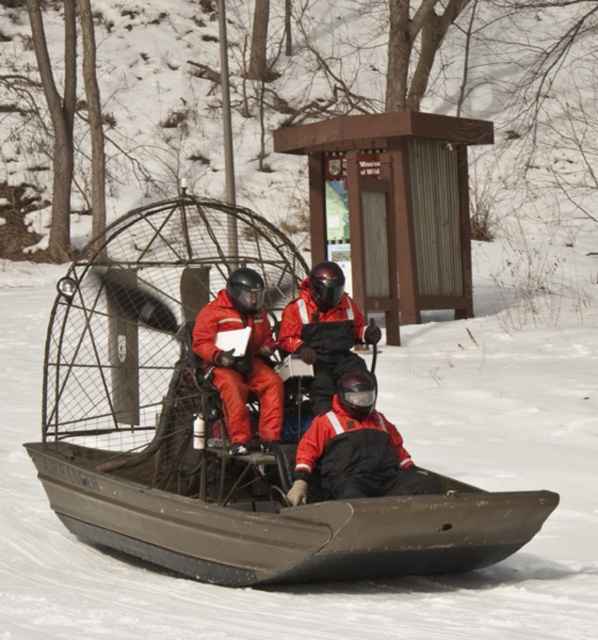
You are a passenger in the airboat and need to locate the black matte jacket at center. Based on the coordinates provided, where should you look to find it?

The black matte jacket at center is located at the 2D coordinates point (353, 449).

You are a drone operator trying to capture a photo of the two points marked in the scene. Which point, point (x=346, y=480) or point (x=344, y=360), will appear larger in your camera frame?

Point (x=346, y=480) is closer to the camera than point (x=344, y=360), so it will appear larger in the camera frame.

You are a member of the rescue team and need to quickly identify the smaller clothing item between the black matte jacket at center and the matte orange jumpsuit at center. Which one should you choose?

The black matte jacket at center is smaller in size compared to the matte orange jumpsuit at center, so you should choose the black matte jacket at center.